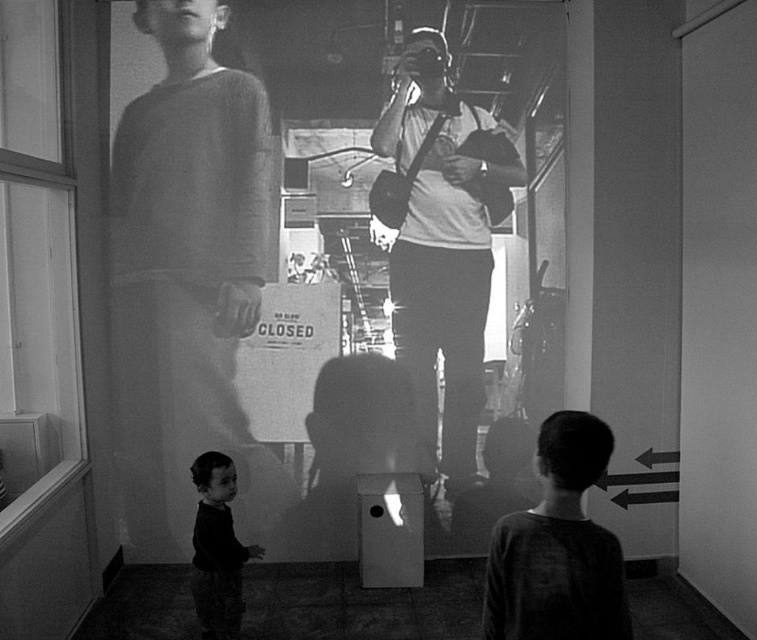
Question: Which object is closer to the camera taking this photo?

Choices:
 (A) knitted sweater at left
 (B) dark fabric baby at lower left
 (C) matte gray shirt at center
 (D) dark gray textured shirt at lower right

Answer: (D)

Question: Does matte gray shirt at center come in front of dark gray textured shirt at lower right?

Choices:
 (A) yes
 (B) no

Answer: (B)

Question: Can you confirm if knitted sweater at left is bigger than matte gray shirt at center?

Choices:
 (A) no
 (B) yes

Answer: (B)

Question: Among these objects, which one is nearest to the camera?

Choices:
 (A) matte gray shirt at center
 (B) knitted sweater at left

Answer: (B)

Question: Is knitted sweater at left positioned before dark gray textured shirt at lower right?

Choices:
 (A) yes
 (B) no

Answer: (B)

Question: Estimate the real-world distances between objects in this image. Which object is farther from the matte gray shirt at center?

Choices:
 (A) knitted sweater at left
 (B) dark fabric baby at lower left

Answer: (B)